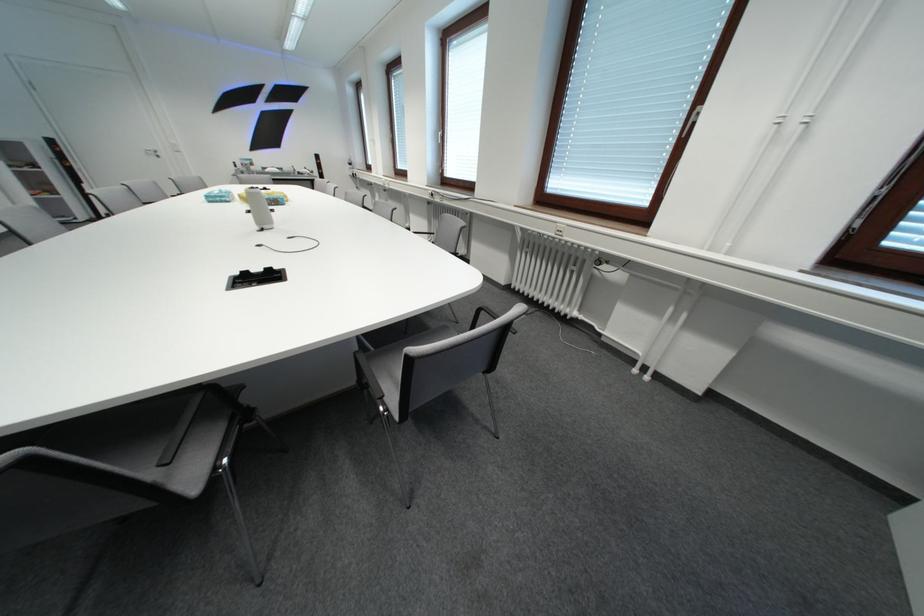
Describe the element at coordinates (442, 140) in the screenshot. The width and height of the screenshot is (924, 616). I see `the white window handle` at that location.